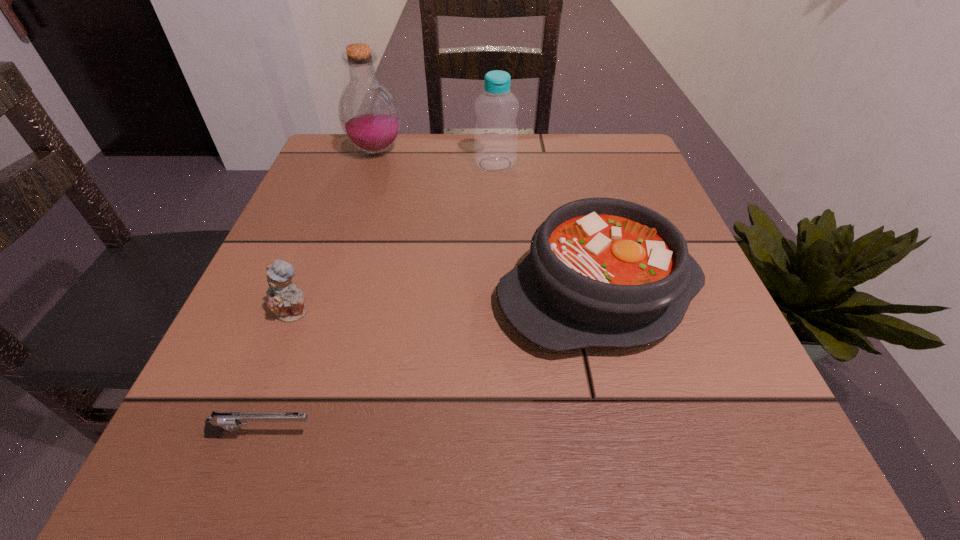
Locate an element on the screen. This screenshot has width=960, height=540. free point between the left bottle and the casserole is located at coordinates (488, 222).

This screenshot has height=540, width=960. I want to click on free space between the pistol and the shorter bottle, so click(378, 300).

Find the location of a particular element. vacant area that lies between the second shortest object and the left bottle is located at coordinates (335, 232).

At what (x,y) coordinates should I click in order to perform the action: click on vacant space in between the second shortest object and the casserole. Please return your answer as a coordinate pair (x, y). Looking at the image, I should click on (446, 303).

Find the location of a particular element. free area in between the second tallest object and the left bottle is located at coordinates (436, 157).

Identify which object is the fourth closest to the left bottle. Please provide its 2D coordinates. Your answer should be formatted as a tuple, i.e. [(x, y)], where the tuple contains the x and y coordinates of a point satisfying the conditions above.

[(219, 421)]

You are a GUI agent. You are given a task and a screenshot of the screen. Output one action in this format:
    pyautogui.click(x=<x>, y=<y>)
    Task: Click on the object that is the second closest to the pistol
    
    Given the screenshot: What is the action you would take?
    pyautogui.click(x=602, y=272)